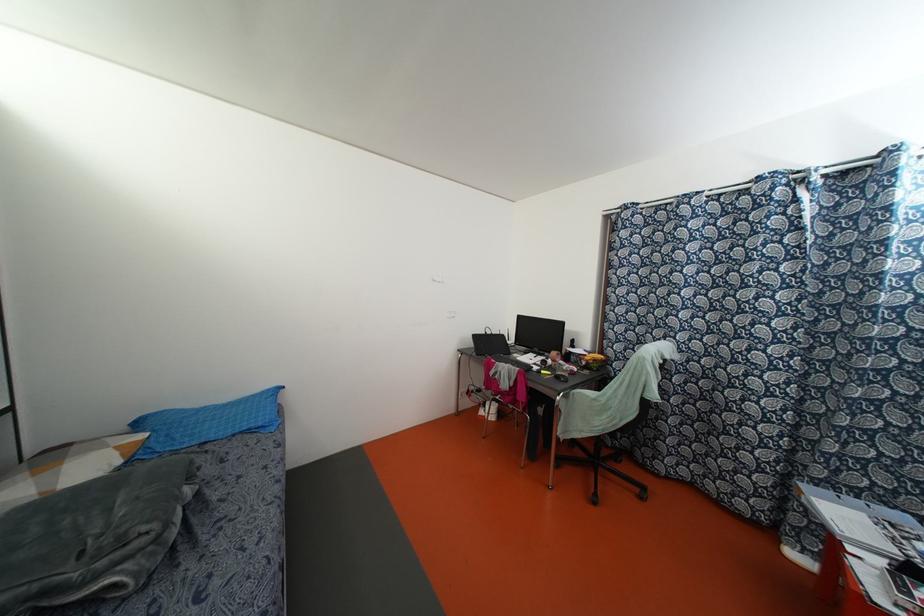
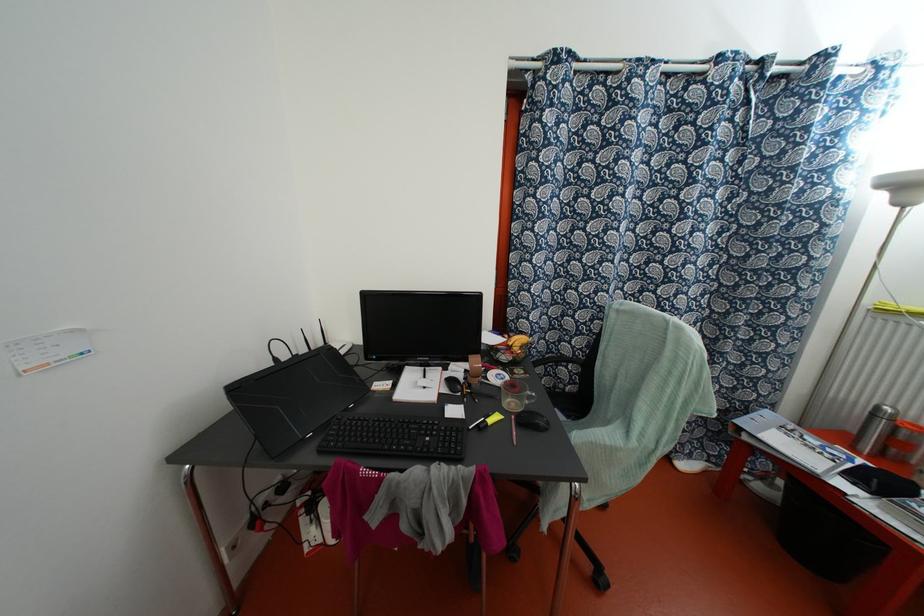
Find the pixel in the second image that matches pixel 528 358 in the first image.

(418, 386)